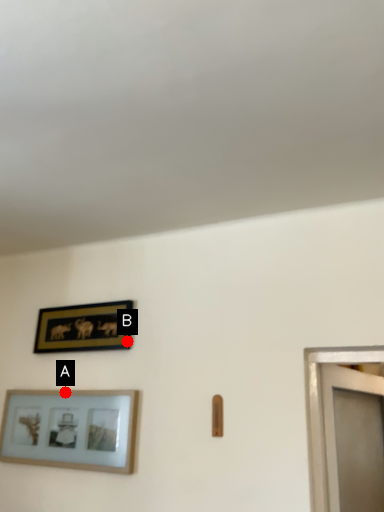
Question: Two points are circled on the image, labeled by A and B beside each circle. Among these points, which one is nearest to the camera?

Choices:
 (A) A is closer
 (B) B is closer

Answer: (B)